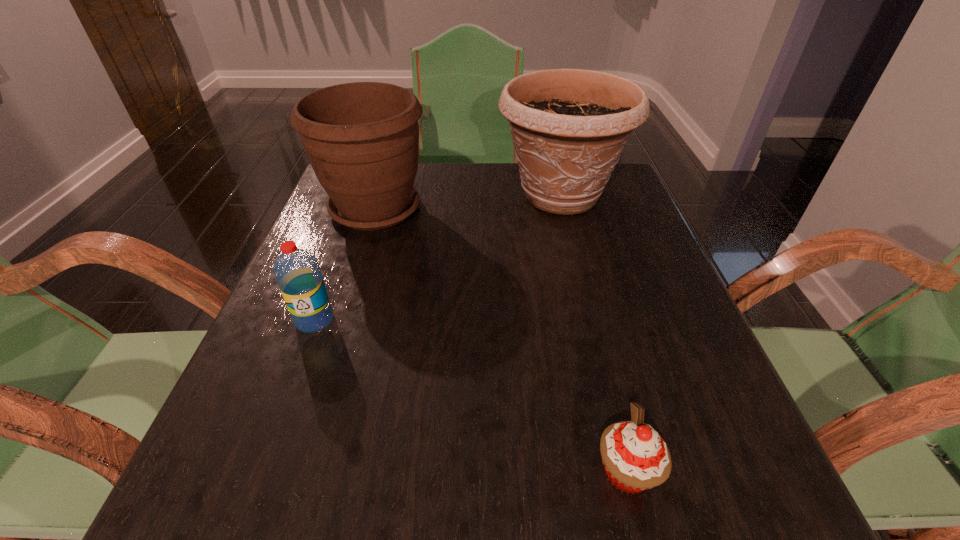
This screenshot has width=960, height=540. In order to click on object at the near edge in this screenshot , I will do `click(635, 457)`.

Image resolution: width=960 pixels, height=540 pixels. I want to click on flowerpot that is at the left edge, so click(x=362, y=139).

Identify the location of water bottle that is at the left edge. The height and width of the screenshot is (540, 960). (297, 272).

Image resolution: width=960 pixels, height=540 pixels. I want to click on flowerpot that is at the right edge, so click(x=569, y=127).

At what (x,y) coordinates should I click in order to perform the action: click on cupcake that is at the right edge. Please return your answer as a coordinate pair (x, y). This screenshot has width=960, height=540. Looking at the image, I should click on (635, 457).

The width and height of the screenshot is (960, 540). What are the coordinates of `object located in the far left corner section of the desktop` in the screenshot? It's located at (362, 139).

I want to click on object that is at the far right corner, so click(x=569, y=127).

What are the coordinates of `object that is at the near right corner` in the screenshot? It's located at (635, 457).

Where is `free space at the far edge of the desktop`? free space at the far edge of the desktop is located at coordinates [517, 165].

Find the location of a particular element. The width and height of the screenshot is (960, 540). vacant space at the near edge is located at coordinates (357, 478).